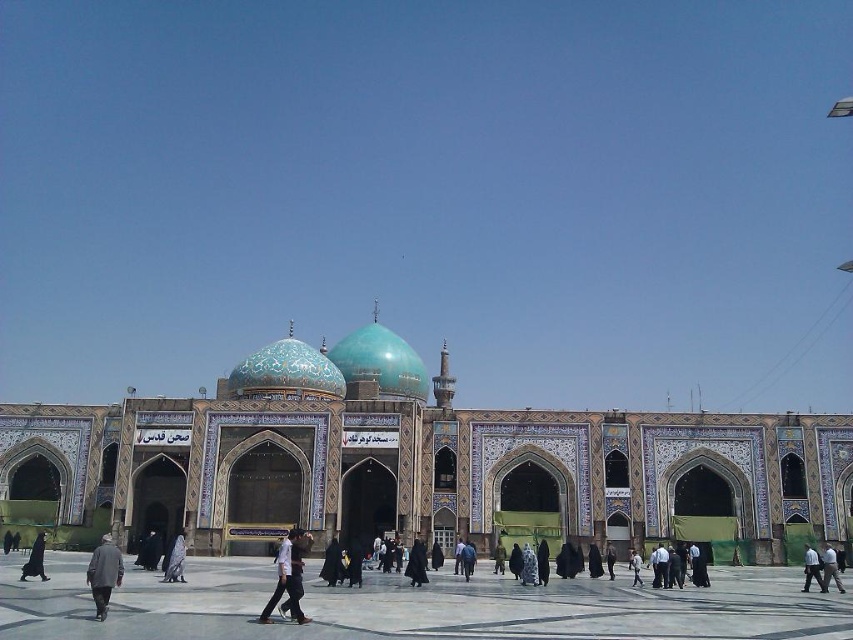
Question: Does black fabric person at center appear on the left side of black matte dress at center?

Choices:
 (A) no
 (B) yes

Answer: (A)

Question: Which of these objects is positioned closest to the black fabric person at center?

Choices:
 (A) light brown fabric pants at lower right
 (B) dark gray fabric person at center
 (C) black matte coat at center
 (D) dark gray fabric at center

Answer: (C)

Question: Does dark gray coat at lower left appear on the right side of light brown fabric pants at lower right?

Choices:
 (A) no
 (B) yes

Answer: (A)

Question: Which point appears farthest from the camera in this image?

Choices:
 (A) (637, 584)
 (B) (310, 358)
 (C) (117, 516)

Answer: (B)

Question: Is black matte coat at center below black matte dress at center?

Choices:
 (A) no
 (B) yes

Answer: (A)

Question: Which point appears farthest from the camera in this image?

Choices:
 (A) coord(38,552)
 (B) coord(102,573)
 (C) coord(817,556)
 (D) coord(247,380)

Answer: (D)